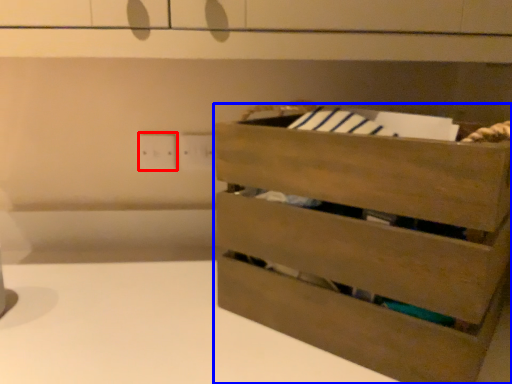
Question: Which object appears closest to the camera in this image, electric outlet (highlighted by a red box) or chest of drawers (highlighted by a blue box)?

Choices:
 (A) electric outlet
 (B) chest of drawers

Answer: (B)